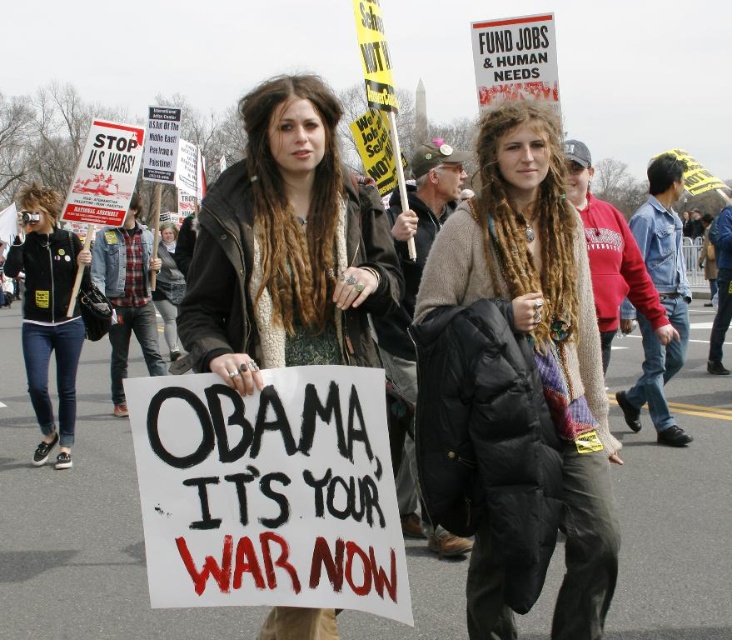
Is matte black jacket at center above knitted sweater at center?

Indeed, matte black jacket at center is positioned over knitted sweater at center.

In the scene shown: Is matte black jacket at center positioned before knitted sweater at center?

Yes, matte black jacket at center is in front of knitted sweater at center.

This screenshot has height=640, width=732. In order to click on matte black jacket at center in this screenshot , I will do `click(285, 246)`.

You are a GUI agent. You are given a task and a screenshot of the screen. Output one action in this format:
    pyautogui.click(x=<x>, y=<y>)
    Task: Click on the matte black jacket at center
    The height and width of the screenshot is (640, 732).
    Given the screenshot: What is the action you would take?
    pyautogui.click(x=285, y=246)

Between knitted sweater at center and black leather jacket at left, which one has less height?

Standing shorter between the two is black leather jacket at left.

Can you confirm if knitted sweater at center is positioned below black leather jacket at left?

Actually, knitted sweater at center is above black leather jacket at left.

The image size is (732, 640). In order to click on knitted sweater at center in this screenshot , I will do (537, 317).

Based on the photo, measure the distance from matte black jacket at center to black leather jacket at left.

14.78 feet

Who is shorter, matte black jacket at center or black leather jacket at left?

matte black jacket at center

Measure the distance between point [212,289] and camera.

A distance of 3.40 meters exists between point [212,289] and camera.

At what (x,y) coordinates should I click in order to perform the action: click on matte black jacket at center. Please return your answer as a coordinate pair (x, y). The width and height of the screenshot is (732, 640). Looking at the image, I should click on (285, 246).